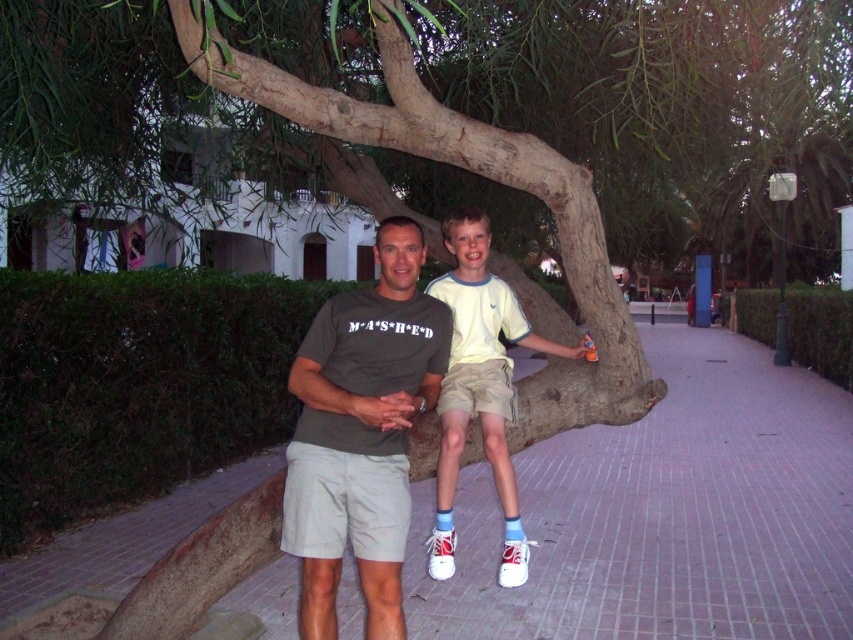
You are a photographer trying to capture the scene. The pink brick pavement at center and matte gray shorts at center are both in the frame. Which object is positioned lower in the image?

The pink brick pavement at center is located below matte gray shorts at center, so it is positioned lower in the image.